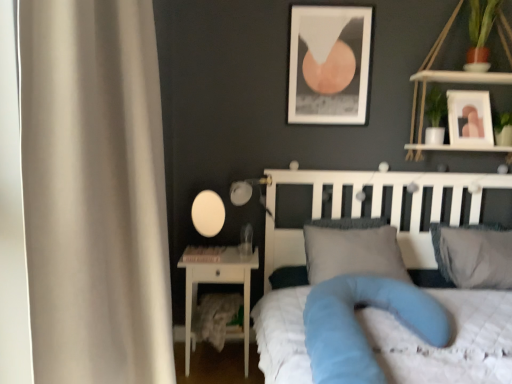
Where is `free space above white glossy nightstand at lower left (from a real-world perspective)`? The image size is (512, 384). free space above white glossy nightstand at lower left (from a real-world perspective) is located at coordinates (x=222, y=252).